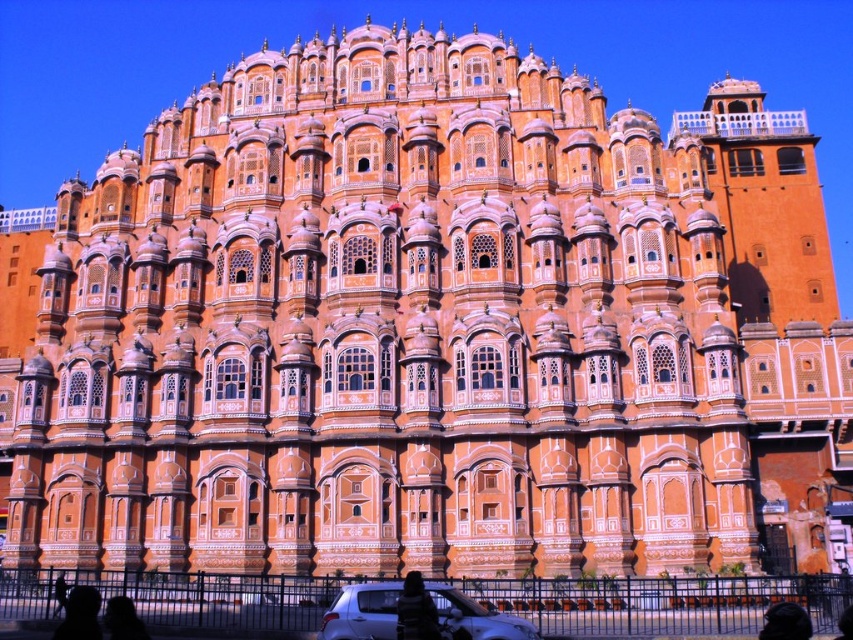
Which is more to the right, silhouette figure at lower left or silhouette skin at lower left?

silhouette skin at lower left is more to the right.

Does silhouette figure at lower left lie in front of silhouette skin at lower left?

That is True.

Is point (91, 589) in front of point (126, 616)?

No, it is not.

What are the coordinates of `silhouette figure at lower left` in the screenshot? It's located at (80, 616).

Which is above, dark gray fabric jacket at lower center or silhouette skin at lower left?

dark gray fabric jacket at lower center is above.

Does dark gray fabric jacket at lower center appear over silhouette skin at lower left?

Yes.

Is point (408, 612) in front of point (109, 627)?

No, (408, 612) is behind (109, 627).

At what (x,y) coordinates should I click in order to perform the action: click on dark gray fabric jacket at lower center. Please return your answer as a coordinate pair (x, y). Looking at the image, I should click on [x=416, y=611].

Describe the element at coordinates (80, 616) in the screenshot. The image size is (853, 640). I see `silhouette figure at lower left` at that location.

Who is shorter, silhouette figure at lower left or black fabric at lower right?

With less height is black fabric at lower right.

Find the location of a particular element. Image resolution: width=853 pixels, height=640 pixels. silhouette figure at lower left is located at coordinates (80, 616).

Locate an element on the screen. The width and height of the screenshot is (853, 640). silhouette figure at lower left is located at coordinates (80, 616).